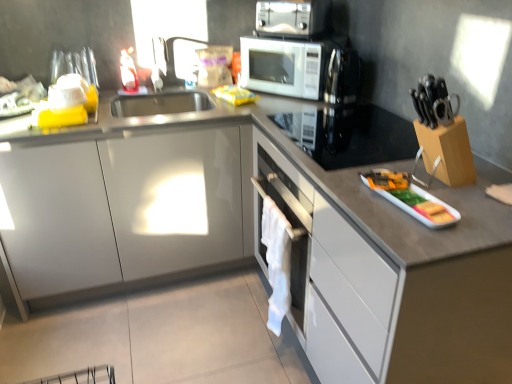
The width and height of the screenshot is (512, 384). I want to click on vacant area on the back side of white glossy tray at right, marked as the second appliance in a back-to-front arrangement, so click(x=390, y=169).